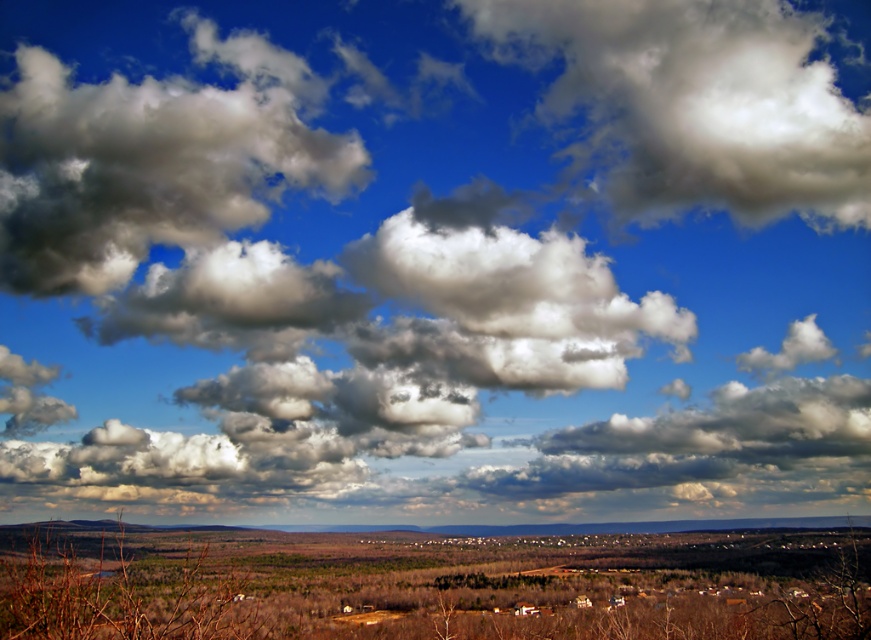
Question: Does brown dry grassland at lower center come in front of cloudy white at left?

Choices:
 (A) no
 (B) yes

Answer: (B)

Question: Is brown dry grassland at lower center positioned in front of cloudy white at left?

Choices:
 (A) no
 (B) yes

Answer: (B)

Question: Is brown dry grassland at lower center positioned at the back of white fluffy cloud at upper center?

Choices:
 (A) yes
 (B) no

Answer: (B)

Question: Which point is farther from the camera taking this photo?

Choices:
 (A) (564, 570)
 (B) (583, 268)
 (C) (142, 525)

Answer: (C)

Question: Which object appears closest to the camera in this image?

Choices:
 (A) brown grassland at lower center
 (B) cloudy white at left
 (C) brown dry grassland at lower center
 (D) white fluffy cloud at upper center

Answer: (C)

Question: Estimate the real-world distances between objects in this image. Which object is closer to the brown dry grassland at lower center?

Choices:
 (A) white fluffy cloud at upper center
 (B) white fluffy cloud at center
 (C) cloudy white at left
 (D) brown grassland at lower center

Answer: (D)